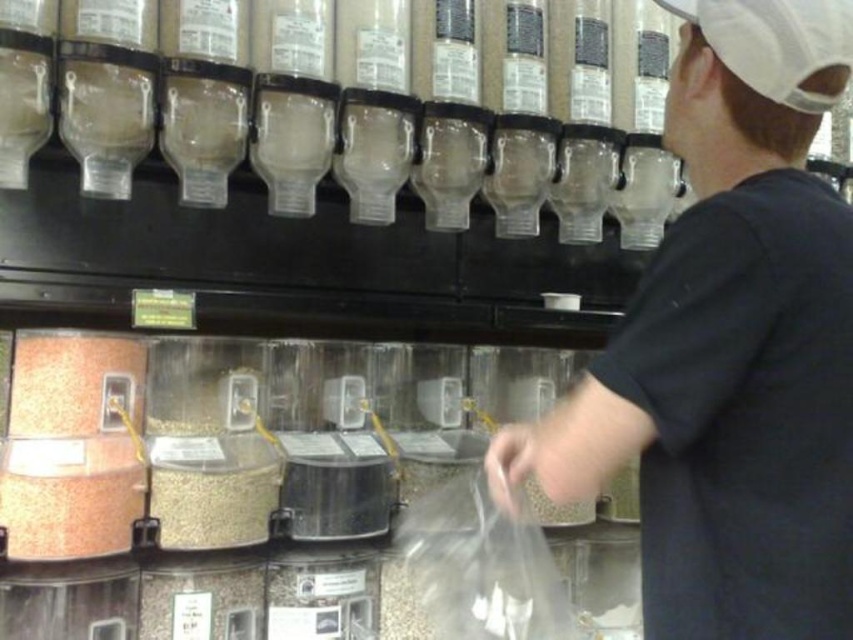
Measure the distance between point (712, 61) and camera.

34.24 inches

Is black matte shirt at center to the left of matte orange powder at lower left from the viewer's perspective?

No, black matte shirt at center is not to the left of matte orange powder at lower left.

Identify the location of black matte shirt at center. (730, 348).

Can you confirm if matte orange powder at lower left is positioned below gray matte grain at center?

Actually, matte orange powder at lower left is above gray matte grain at center.

Where is `matte orange powder at lower left`? matte orange powder at lower left is located at coordinates (74, 384).

Is point (97, 336) behind point (149, 493)?

That is True.

Find the location of a particular element. The image size is (853, 640). matte orange powder at lower left is located at coordinates (74, 384).

Can you confirm if black matte shirt at center is smaller than gray matte grain at center?

Incorrect, black matte shirt at center is not smaller in size than gray matte grain at center.

Is black matte shirt at center bigger than gray matte grain at center?

Correct, black matte shirt at center is larger in size than gray matte grain at center.

What do you see at coordinates (730, 348) in the screenshot?
I see `black matte shirt at center` at bounding box center [730, 348].

Locate an element on the screen. Image resolution: width=853 pixels, height=640 pixels. black matte shirt at center is located at coordinates (730, 348).